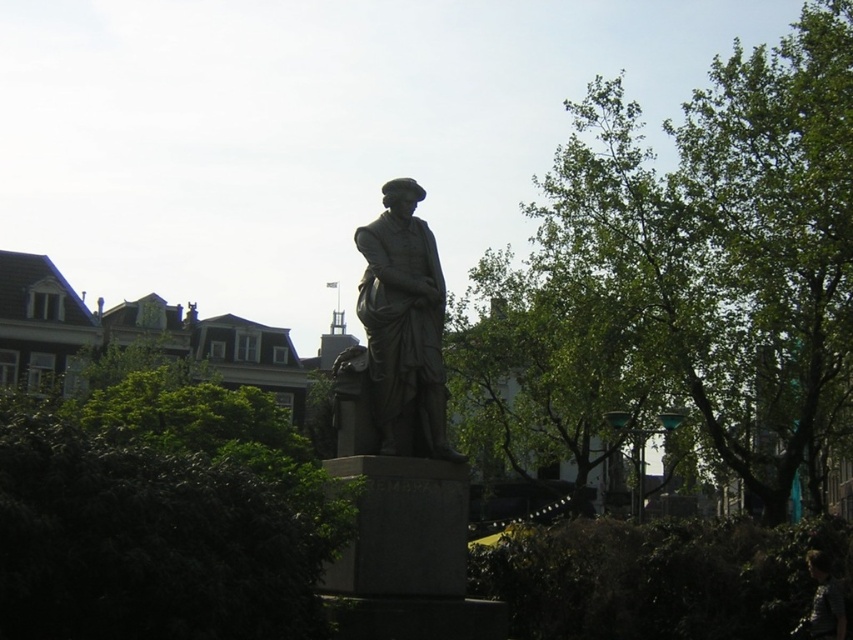
You are standing in front of the statue and notice the green leafy bush at center and the dark brown hair at lower right. Which object is positioned to the left of the other?

The green leafy bush at center is positioned to the left of the dark brown hair at lower right.

You are a gardener who needs to trim the green leafy bush at center and the dark brown hair at lower right. Which one should you trim first if you want to start with the one closer to you?

The green leafy bush at center is in front of the dark brown hair at lower right, so you should trim the green leafy bush at center first since it is closer to you.

You are standing at the statue and want to take a photo of both point (x=370, y=241) and point (x=845, y=625) in the background. Which point should you position closer to the camera to include both in the frame?

You should position the camera closer to point (x=370, y=241) because it is in front of point (x=845, y=625), allowing both to be captured in the frame.